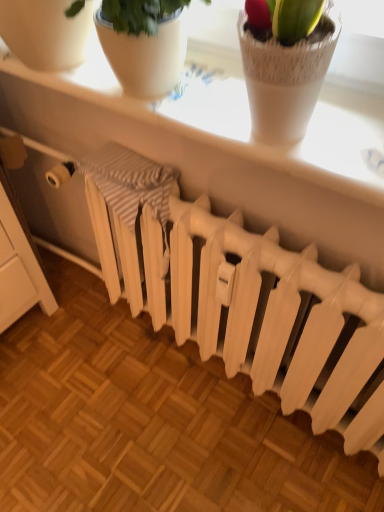
You are a GUI agent. You are given a task and a screenshot of the screen. Output one action in this format:
    pyautogui.click(x=<x>, y=<y>)
    Task: Click on the white matte radiator at center
    The width and height of the screenshot is (384, 512).
    Given the screenshot: What is the action you would take?
    pyautogui.click(x=279, y=319)

The height and width of the screenshot is (512, 384). What do you see at coordinates (279, 319) in the screenshot?
I see `white matte radiator at center` at bounding box center [279, 319].

Locate an element on the screen. The width and height of the screenshot is (384, 512). white textured window sill at upper center is located at coordinates (215, 127).

Image resolution: width=384 pixels, height=512 pixels. Describe the element at coordinates (215, 127) in the screenshot. I see `white textured window sill at upper center` at that location.

Where is `white matte radiator at center`? The width and height of the screenshot is (384, 512). white matte radiator at center is located at coordinates (279, 319).

Between white textured window sill at upper center and white matte radiator at center, which one appears on the left side from the viewer's perspective?

From the viewer's perspective, white textured window sill at upper center appears more on the left side.

Relative to white matte radiator at center, is white textured window sill at upper center in front or behind?

In the image, white textured window sill at upper center appears in front of white matte radiator at center.

Between point (334, 185) and point (281, 335), which one is positioned in front?

The point (334, 185) is closer.

From the image's perspective, is white textured window sill at upper center located above or below white matte radiator at center?

white textured window sill at upper center is above white matte radiator at center.

From a real-world perspective, which object stands above the other?

From a 3D spatial view, white textured window sill at upper center is above.

Is white textured window sill at upper center thinner than white matte radiator at center?

Incorrect, the width of white textured window sill at upper center is not less than that of white matte radiator at center.

From the picture: Does white textured window sill at upper center have a greater height compared to white matte radiator at center?

No, white textured window sill at upper center is not taller than white matte radiator at center.

Looking at the image, does white textured window sill at upper center seem bigger or smaller compared to white matte radiator at center?

white textured window sill at upper center is smaller than white matte radiator at center.

Is white textured window sill at upper center completely or partially outside of white matte radiator at center?

Yes, white textured window sill at upper center is not within white matte radiator at center.

Are white textured window sill at upper center and white matte radiator at center far apart?

No, white textured window sill at upper center is not far from white matte radiator at center.

Could you tell me if white textured window sill at upper center is facing white matte radiator at center?

No, white textured window sill at upper center is not aimed at white matte radiator at center.

How different are the orientations of white textured window sill at upper center and white matte radiator at center in degrees?

The angular difference between white textured window sill at upper center and white matte radiator at center is 0.229 degrees.

Identify the location of window sill above the white matte radiator at center (from the image's perspective). The image size is (384, 512). (215, 127).

Is white matte radiator at center to the left of white textured window sill at upper center from the viewer's perspective?

No, white matte radiator at center is not to the left of white textured window sill at upper center.

Considering the positions of objects white matte radiator at center and white textured window sill at upper center in the image provided, who is in front, white matte radiator at center or white textured window sill at upper center?

white textured window sill at upper center is closer to the camera.

Considering the positions of points (338, 329) and (349, 140), is point (338, 329) closer to camera compared to point (349, 140)?

No.

From the image's perspective, is white matte radiator at center below white textured window sill at upper center?

Yes, from the image's perspective, white matte radiator at center is beneath white textured window sill at upper center.

From a real-world perspective, is white matte radiator at center positioned above or below white textured window sill at upper center?

white matte radiator at center is situated lower than white textured window sill at upper center in the real world.

Which of these two, white matte radiator at center or white textured window sill at upper center, is thinner?

white matte radiator at center.

From their relative heights in the image, would you say white matte radiator at center is taller or shorter than white textured window sill at upper center?

In the image, white matte radiator at center appears to be taller than white textured window sill at upper center.

Considering the sizes of objects white matte radiator at center and white textured window sill at upper center in the image provided, who is bigger, white matte radiator at center or white textured window sill at upper center?

With larger size is white matte radiator at center.

Is white matte radiator at center located outside white textured window sill at upper center?

white matte radiator at center is positioned outside white textured window sill at upper center.

Are white matte radiator at center and white textured window sill at upper center making contact?

No, white matte radiator at center is not in contact with white textured window sill at upper center.

Is white matte radiator at center oriented towards white textured window sill at upper center?

No, white matte radiator at center is not oriented towards white textured window sill at upper center.

In order to click on window sill above the white matte radiator at center (from a real-world perspective) in this screenshot , I will do `click(215, 127)`.

You are a GUI agent. You are given a task and a screenshot of the screen. Output one action in this format:
    pyautogui.click(x=<x>, y=<y>)
    Task: Click on the radiator that is under the white textured window sill at upper center (from a real-world perspective)
    This screenshot has height=512, width=384.
    Given the screenshot: What is the action you would take?
    pyautogui.click(x=279, y=319)

What are the coordinates of `window sill that is in front of the white matte radiator at center` in the screenshot? It's located at (215, 127).